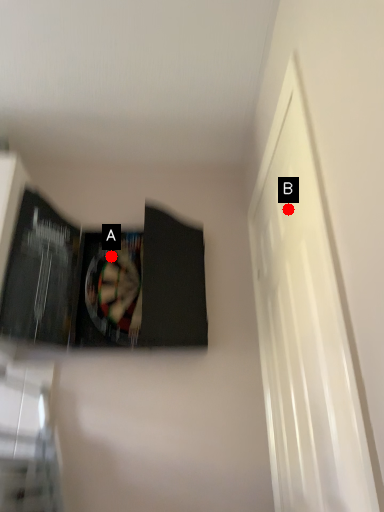
Question: Two points are circled on the image, labeled by A and B beside each circle. Which point is closer to the camera taking this photo?

Choices:
 (A) A is closer
 (B) B is closer

Answer: (B)